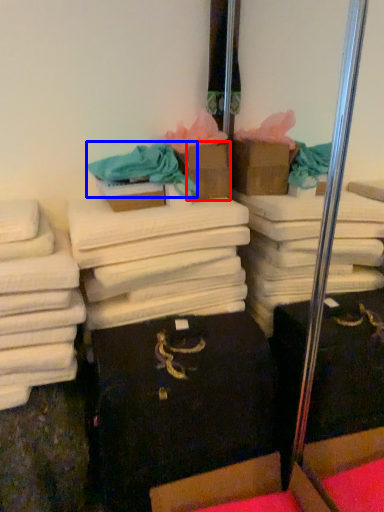
Question: Which point is closer to the camera, cardboard box (highlighted by a red box) or clothing (highlighted by a blue box)?

Choices:
 (A) cardboard box
 (B) clothing

Answer: (B)